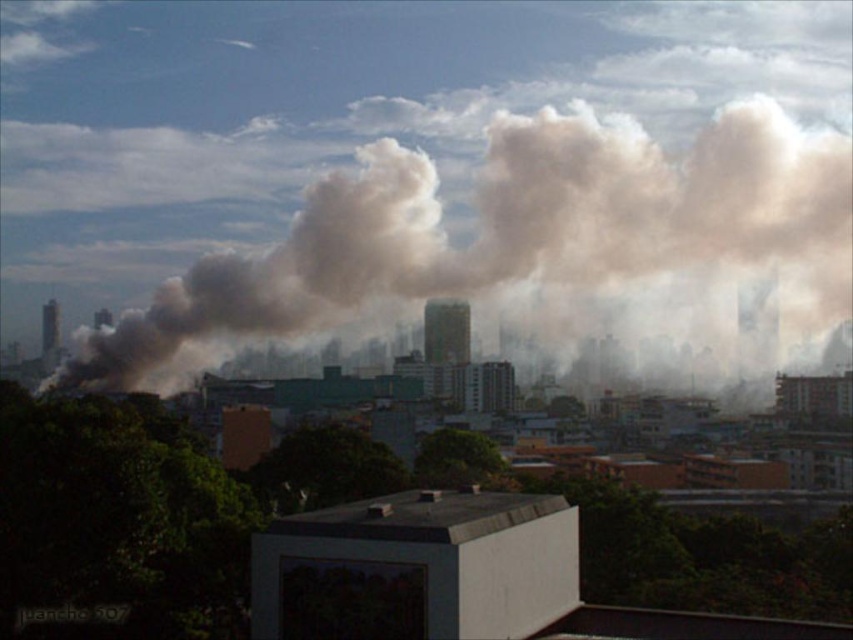
You are a drone operator trying to navigate between two points in the image. The first point is labeled as point (103, 360) and the second is point (57, 323). According to the scene, which point is closer to the observer?

Point (103, 360) is in front of point (57, 323), so it is closer to the observer.

You are a firefighter assessing the situation from a safe distance. You notice the gray smoke at center and the black glass chimney at left. Based on their sizes, which object would you prioritize addressing first, and why?

The gray smoke at center is larger in size than the black glass chimney at left, so you should prioritize addressing the gray smoke at center first because its larger size indicates a more significant fire source that requires immediate attention to prevent further spread.